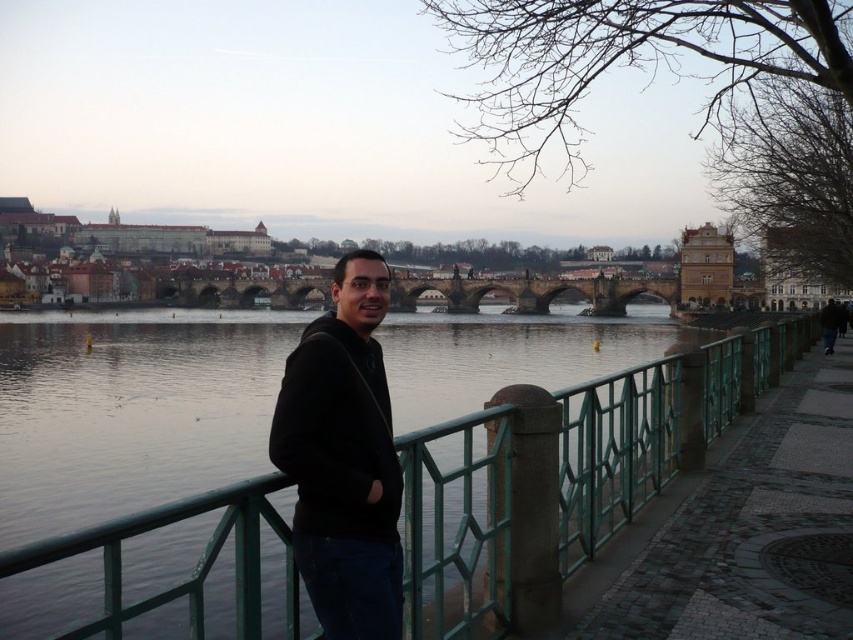
Question: Based on their relative distances, which object is farther from the black matte hoodie at center?

Choices:
 (A) brown leather jacket at lower right
 (B) stone arch bridge at center
 (C) green metallic water at center

Answer: (B)

Question: Does stone arch bridge at center appear under brown leather jacket at lower right?

Choices:
 (A) yes
 (B) no

Answer: (B)

Question: Does black matte hoodie at center have a smaller size compared to brown leather jacket at lower right?

Choices:
 (A) yes
 (B) no

Answer: (A)

Question: Which point is farther to the camera?

Choices:
 (A) (x=352, y=499)
 (B) (x=444, y=298)

Answer: (B)

Question: Which point is farther to the camera?

Choices:
 (A) brown leather jacket at lower right
 (B) green metallic water at center

Answer: (A)

Question: Does green metallic water at center have a smaller size compared to stone arch bridge at center?

Choices:
 (A) no
 (B) yes

Answer: (A)